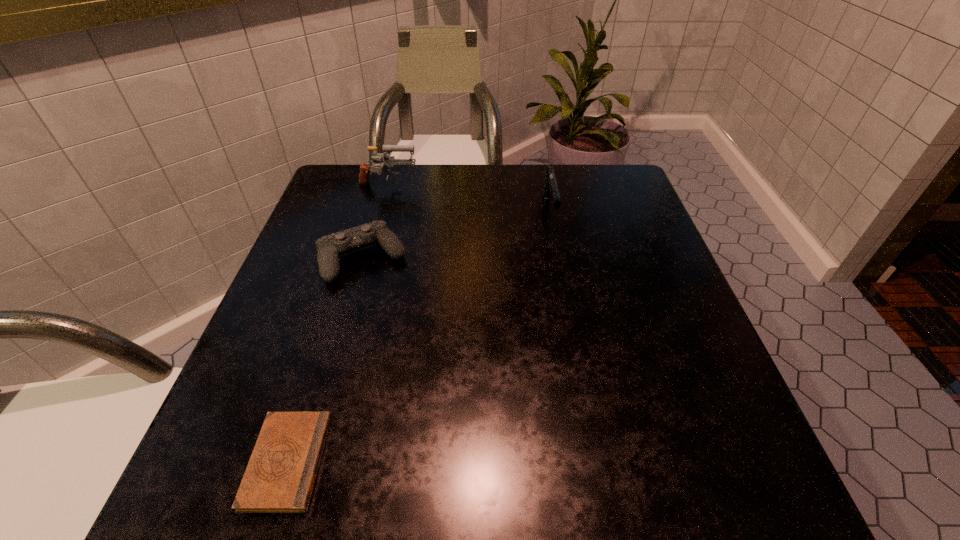
In order to click on free space between the shorter gun and the nearest object in this screenshot , I will do `click(419, 336)`.

Where is `free spot between the shortest object and the second nearest object`? free spot between the shortest object and the second nearest object is located at coordinates (325, 360).

Identify the location of vacant point located between the control and the rightmost object. Image resolution: width=960 pixels, height=540 pixels. (456, 234).

Where is `object that is the closest to the nearest object`? object that is the closest to the nearest object is located at coordinates (330, 247).

Locate which object ranks third in proximity to the right gun. Please provide its 2D coordinates. Your answer should be formatted as a tuple, i.e. [(x, y)], where the tuple contains the x and y coordinates of a point satisfying the conditions above.

[(280, 476)]

Find the location of a particular element. Image resolution: width=960 pixels, height=540 pixels. blank area in the image that satisfies the following two spatial constraints: 1. at the aiming end of the rightmost object; 2. on the spine side of the diary is located at coordinates (598, 461).

Image resolution: width=960 pixels, height=540 pixels. Find the location of `free spot that satisfies the following two spatial constraints: 1. at the aiming end of the shorter gun; 2. on the spine side of the shortest object`. free spot that satisfies the following two spatial constraints: 1. at the aiming end of the shorter gun; 2. on the spine side of the shortest object is located at coordinates (598, 461).